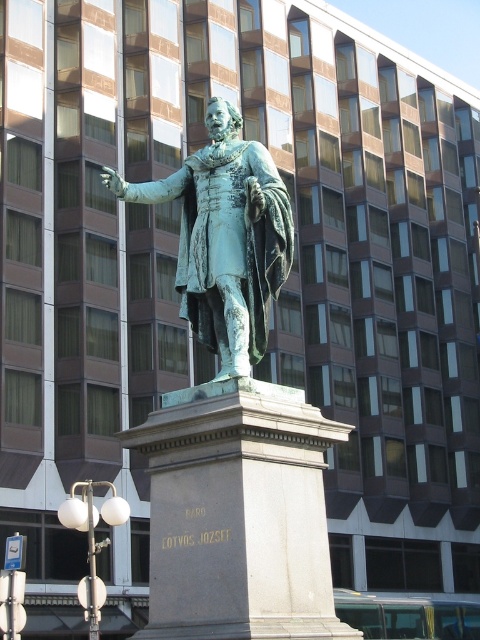
Question: Observing the image, what is the correct spatial positioning of green patina statue at center in reference to green patina bronze statue at center?

Choices:
 (A) left
 (B) right

Answer: (B)

Question: From the image, what is the correct spatial relationship of green patina statue at center in relation to green patina bronze statue at center?

Choices:
 (A) right
 (B) left

Answer: (A)

Question: Which point is farther to the camera?

Choices:
 (A) green patina statue at center
 (B) green patina bronze statue at center

Answer: (B)

Question: Which object appears farthest from the camera in this image?

Choices:
 (A) green patina statue at center
 (B) green patina bronze statue at center

Answer: (B)

Question: Is green patina statue at center below green patina bronze statue at center?

Choices:
 (A) yes
 (B) no

Answer: (A)